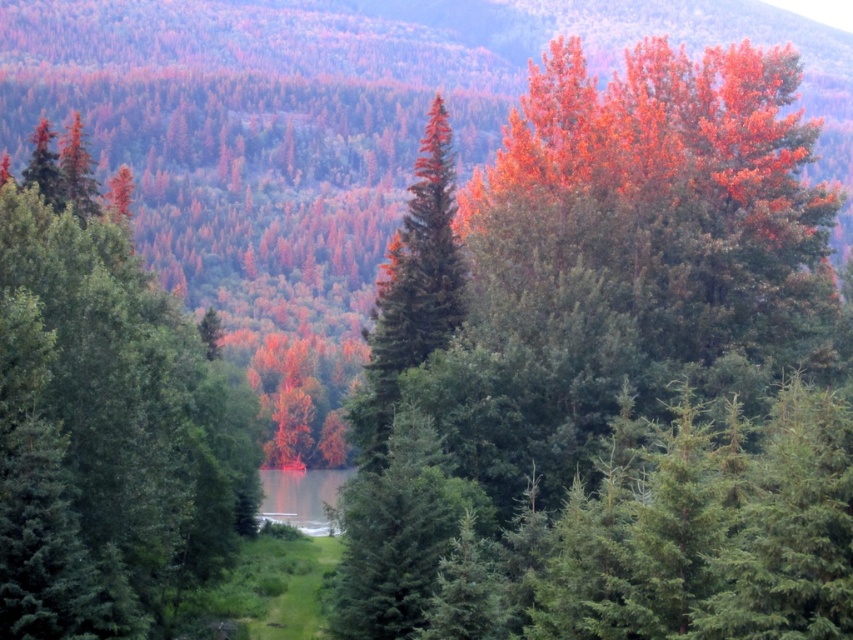
Does orange-red foliage at center appear on the right side of green matte tree at center?

Correct, you'll find orange-red foliage at center to the right of green matte tree at center.

How far apart are orange-red foliage at center and green matte tree at center?

orange-red foliage at center is 8.14 meters away from green matte tree at center.

Locate an element on the screen. This screenshot has width=853, height=640. orange-red foliage at center is located at coordinates (624, 376).

Where is `orange-red foliage at center`? Image resolution: width=853 pixels, height=640 pixels. orange-red foliage at center is located at coordinates (624, 376).